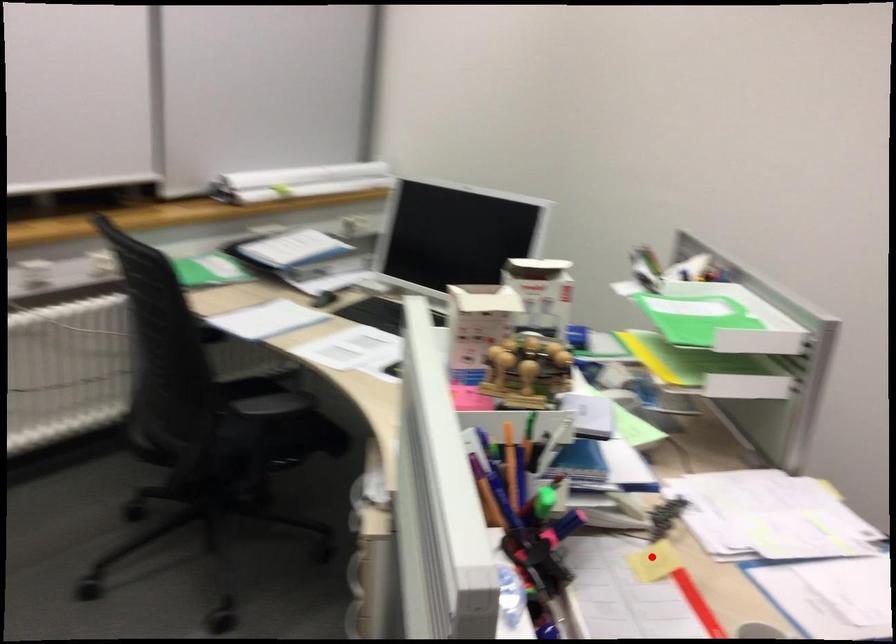
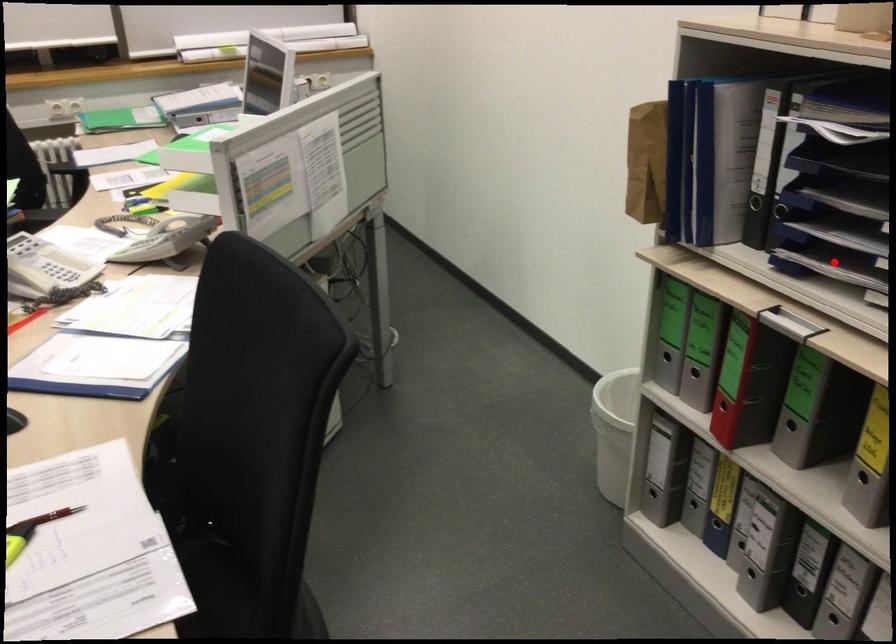
Looking at this image, I am providing you with two images of the same scene from different viewpoints. A red point is marked on the first image and another point is marked on the second image. Is the red point in image1 aligned with the point shown in image2?

No